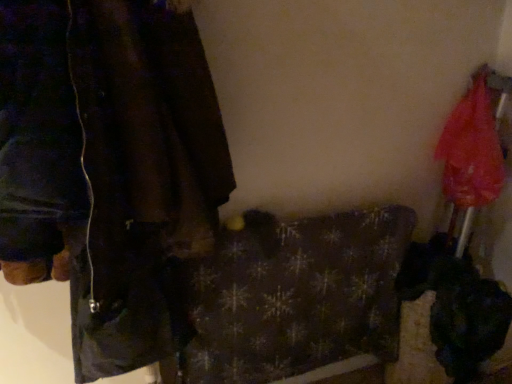
This screenshot has width=512, height=384. Describe the element at coordinates (472, 153) in the screenshot. I see `translucent nylon umbrella at right` at that location.

Describe the element at coordinates (110, 167) in the screenshot. This screenshot has height=384, width=512. I see `dark brown leather jacket at left` at that location.

Find the location of a particular element. This screenshot has height=384, width=512. dark plaid blanket at center is located at coordinates (295, 299).

Would you say translucent nylon umbrella at right is to the left or to the right of dark plaid blanket at center in the picture?

Clearly, translucent nylon umbrella at right is on the right of dark plaid blanket at center in the image.

Locate an element on the screen. The height and width of the screenshot is (384, 512). blanket lying in front of the translucent nylon umbrella at right is located at coordinates (295, 299).

Is translucent nylon umbrella at right taller than dark plaid blanket at center?

No.

From a real-world perspective, is translucent nylon umbrella at right located beneath dark plaid blanket at center?

Actually, translucent nylon umbrella at right is physically above dark plaid blanket at center in the real world.

From the image's perspective, which one is positioned lower, translucent nylon umbrella at right or dark brown leather jacket at left?

dark brown leather jacket at left is shown below in the image.

Can we say translucent nylon umbrella at right lies outside dark brown leather jacket at left?

translucent nylon umbrella at right lies outside dark brown leather jacket at left's area.

Considering the positions of objects translucent nylon umbrella at right and dark brown leather jacket at left in the image provided, who is in front, translucent nylon umbrella at right or dark brown leather jacket at left?

Positioned in front is dark brown leather jacket at left.

Which object is positioned more to the right, translucent nylon umbrella at right or dark brown leather jacket at left?

translucent nylon umbrella at right is more to the right.

Between dark brown leather jacket at left and translucent nylon umbrella at right, which one has larger width?

With larger width is dark brown leather jacket at left.

Is point (180, 290) closer or farther from the camera than point (470, 175)?

Clearly, point (180, 290) is closer to the camera than point (470, 175).

Can you confirm if dark brown leather jacket at left is positioned to the left of translucent nylon umbrella at right?

Indeed, dark brown leather jacket at left is positioned on the left side of translucent nylon umbrella at right.

From the image's perspective, between dark brown leather jacket at left and translucent nylon umbrella at right, who is located below?

dark brown leather jacket at left is shown below in the image.

Does dark plaid blanket at center have a lesser height compared to translucent nylon umbrella at right?

No.

Which is behind, point (259, 305) or point (492, 182)?

The point (259, 305) is farther from the camera.

Does point (75, 228) come closer to viewer compared to point (406, 233)?

Yes.

In terms of size, does dark brown leather jacket at left appear bigger or smaller than dark plaid blanket at center?

dark brown leather jacket at left is bigger than dark plaid blanket at center.

From the image's perspective, would you say dark brown leather jacket at left is positioned over dark plaid blanket at center?

Correct, dark brown leather jacket at left appears higher than dark plaid blanket at center in the image.

At what (x,y) coordinates should I click in order to perform the action: click on blanket located underneath the dark brown leather jacket at left (from a real-world perspective). Please return your answer as a coordinate pair (x, y). The height and width of the screenshot is (384, 512). Looking at the image, I should click on (295, 299).

Is dark plaid blanket at center looking in the opposite direction of dark brown leather jacket at left?

dark plaid blanket at center is not turned away from dark brown leather jacket at left.

From the image's perspective, relative to dark brown leather jacket at left, is dark plaid blanket at center above or below?

dark plaid blanket at center is situated lower than dark brown leather jacket at left in the image.

Which object is thinner, dark plaid blanket at center or dark brown leather jacket at left?

Thinner between the two is dark plaid blanket at center.

Where is `blanket below the translucent nylon umbrella at right (from a real-world perspective)`? The height and width of the screenshot is (384, 512). blanket below the translucent nylon umbrella at right (from a real-world perspective) is located at coordinates (295, 299).

Find the location of `umbrella that appears above the dark brown leather jacket at left (from the image's perspective)`. umbrella that appears above the dark brown leather jacket at left (from the image's perspective) is located at coordinates (472, 153).

In the scene shown: When comparing their distances from dark brown leather jacket at left, does dark plaid blanket at center or translucent nylon umbrella at right seem closer?

dark plaid blanket at center is closer to dark brown leather jacket at left.

From the image, which object appears to be nearer to dark plaid blanket at center, dark brown leather jacket at left or translucent nylon umbrella at right?

Based on the image, dark brown leather jacket at left appears to be nearer to dark plaid blanket at center.

Consider the image. Which object lies nearer to the anchor point translucent nylon umbrella at right, dark brown leather jacket at left or dark plaid blanket at center?

dark plaid blanket at center is positioned closer to the anchor translucent nylon umbrella at right.

Looking at the image, which one is located further to translucent nylon umbrella at right, dark plaid blanket at center or dark brown leather jacket at left?

dark brown leather jacket at left lies further to translucent nylon umbrella at right than the other object.

When comparing their distances from dark brown leather jacket at left, does translucent nylon umbrella at right or dark plaid blanket at center seem closer?

dark plaid blanket at center is closer to dark brown leather jacket at left.

Looking at the image, which one is located further to dark plaid blanket at center, translucent nylon umbrella at right or dark brown leather jacket at left?

translucent nylon umbrella at right is further to dark plaid blanket at center.

Find the location of a particular element. The height and width of the screenshot is (384, 512). blanket situated between dark brown leather jacket at left and translucent nylon umbrella at right from left to right is located at coordinates click(295, 299).